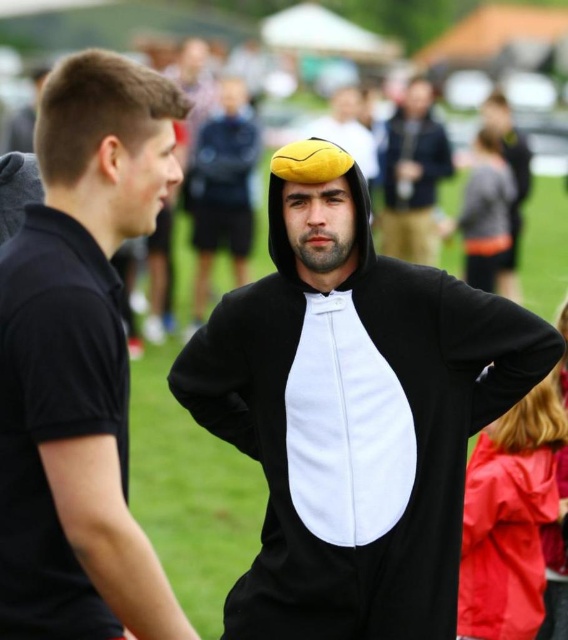
You are a photographer at the event and want to capture a photo that includes both the black fleece onesie at right and the matte yellow beret at upper center. Based on their positions, which object should be placed on the left side of the photo to ensure both are in frame?

The black fleece onesie at right should be placed on the left side of the photo because it is positioned on the left side of the matte yellow beret at upper center, ensuring both are included in the frame.

You are a photographer at the event and want to ensure both the black fleece onesie at center and the black fleece onesie at right are in focus. Which one requires you to adjust your camera focus to a closer distance?

The black fleece onesie at center requires adjusting the camera focus to a closer distance because it is thinner than the black fleece onesie at right, meaning it is closer to the camera.